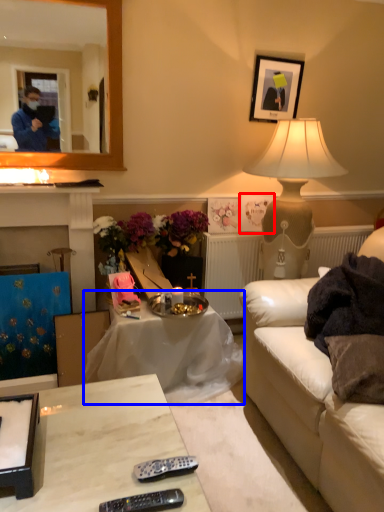
Question: Which point is further to the camera, picture frame (highlighted by a red box) or table (highlighted by a blue box)?

Choices:
 (A) picture frame
 (B) table

Answer: (A)